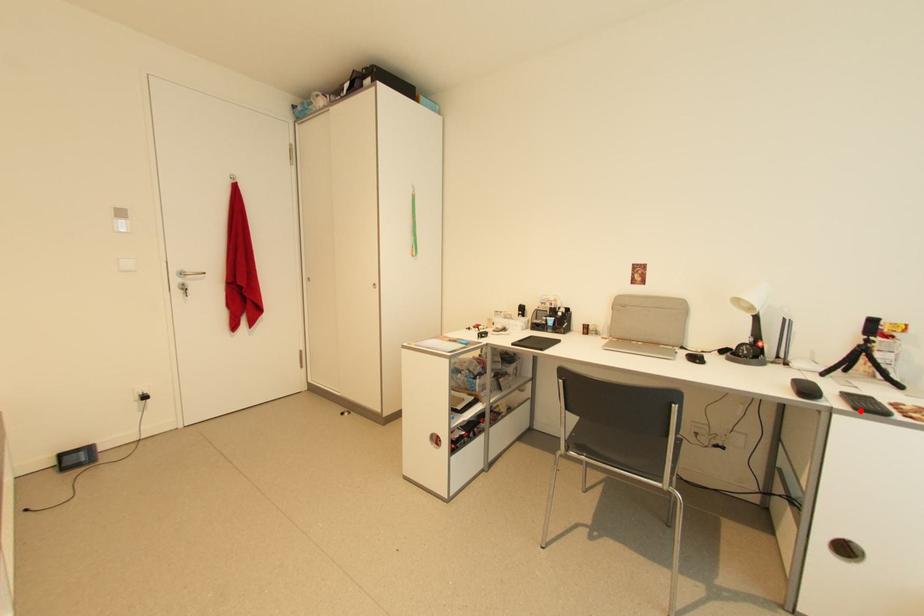
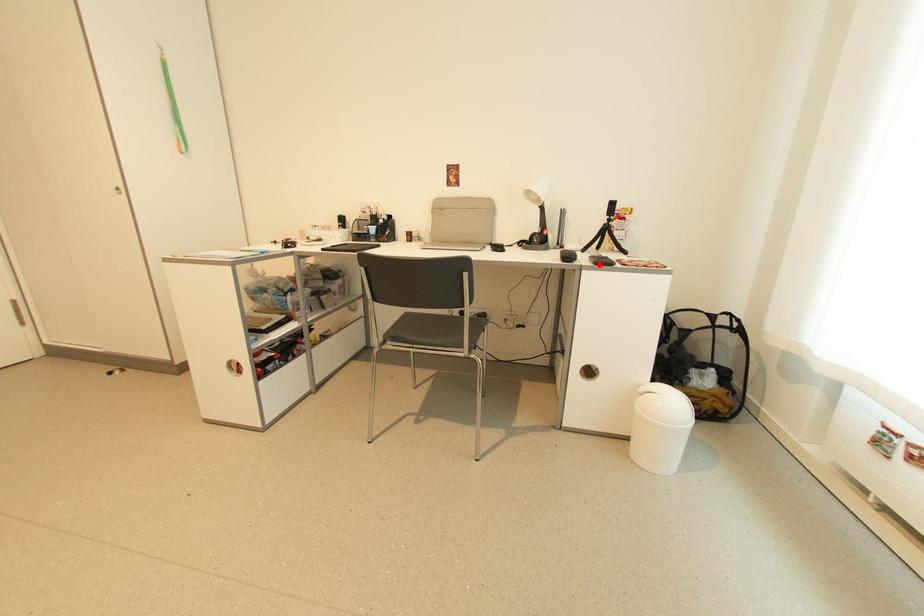
I am providing you with two images of the same scene from different viewpoints. A red point is marked on the first image and another point is marked on the second image. Do the highlighted points in image1 and image2 indicate the same real-world spot?

Yes